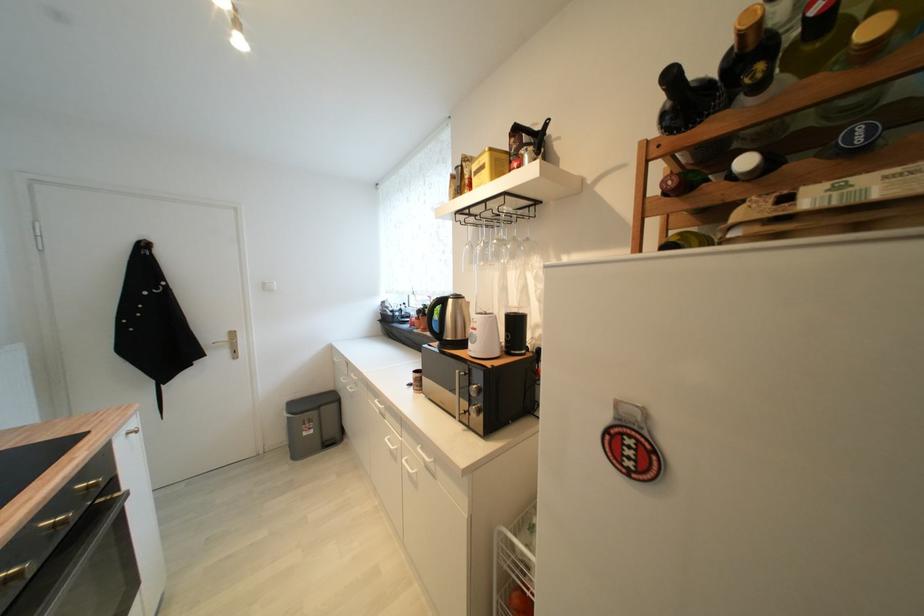
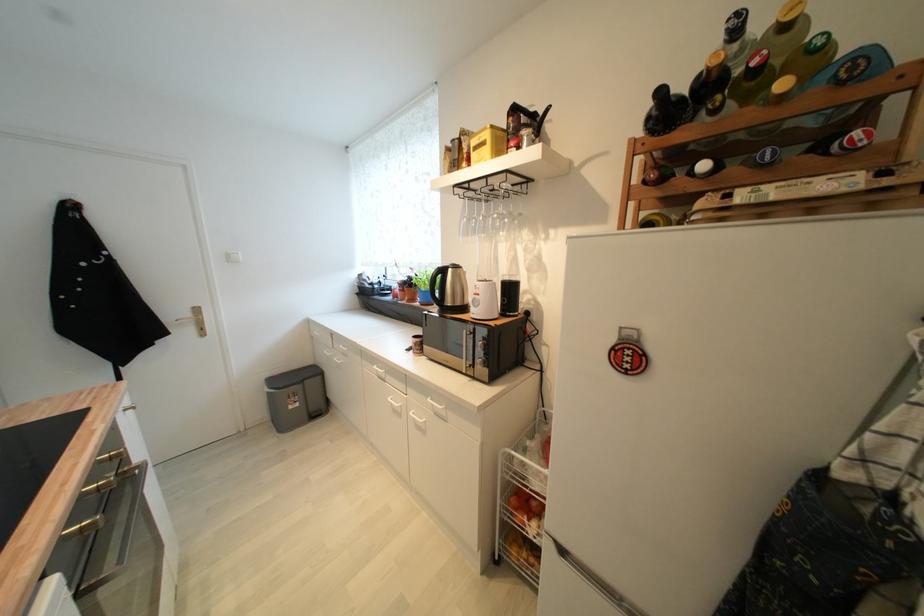
In the second image, find the point that corresponds to (857,134) in the first image.

(769, 155)